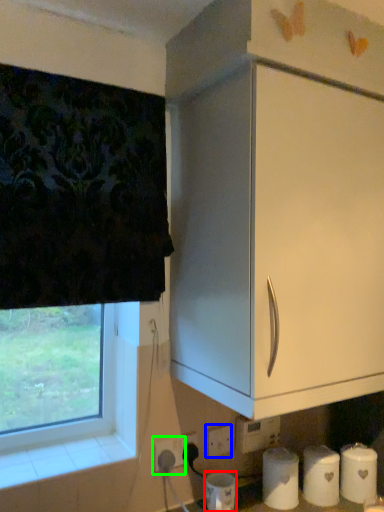
Question: Considering the real-world distances, which object is closest to paper towel (highlighted by a red box)? electric outlet (highlighted by a blue box) or electric outlet (highlighted by a green box).

Choices:
 (A) electric outlet
 (B) electric outlet

Answer: (A)